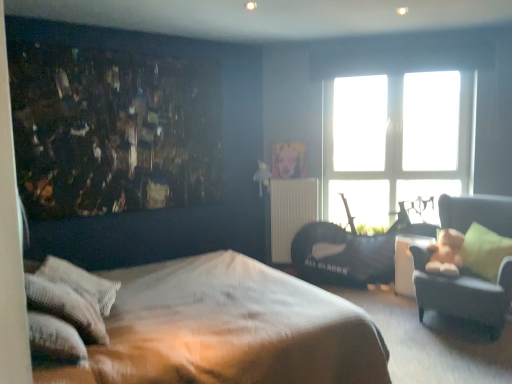
Question: Is brown textured bed at center touching black leather swivel chair at right?

Choices:
 (A) no
 (B) yes

Answer: (A)

Question: Is brown textured bed at center positioned before black leather swivel chair at right?

Choices:
 (A) no
 (B) yes

Answer: (B)

Question: From the image's perspective, is brown textured bed at center below black leather swivel chair at right?

Choices:
 (A) yes
 (B) no

Answer: (A)

Question: Is brown textured bed at center facing towards black leather swivel chair at right?

Choices:
 (A) no
 (B) yes

Answer: (B)

Question: From the image's perspective, would you say brown textured bed at center is positioned over black leather swivel chair at right?

Choices:
 (A) no
 (B) yes

Answer: (A)

Question: Is black leather swivel chair at right inside or outside of green fabric pillow at right, marked as the third pillow in a left-to-right arrangement?

Choices:
 (A) outside
 (B) inside

Answer: (A)

Question: Considering the positions of black leather swivel chair at right and green fabric pillow at right, arranged as the first pillow when viewed from the right, in the image, is black leather swivel chair at right bigger or smaller than green fabric pillow at right, arranged as the first pillow when viewed from the right,?

Choices:
 (A) small
 (B) big

Answer: (B)

Question: From a real-world perspective, is black leather swivel chair at right positioned above or below green fabric pillow at right, marked as the third pillow in a left-to-right arrangement?

Choices:
 (A) below
 (B) above

Answer: (A)

Question: Visually, is black leather swivel chair at right positioned to the left or to the right of green fabric pillow at right, marked as the third pillow in a left-to-right arrangement?

Choices:
 (A) left
 (B) right

Answer: (A)

Question: Considering the positions of metallic gold radiator at center and brown textured bed at center in the image, is metallic gold radiator at center wider or thinner than brown textured bed at center?

Choices:
 (A) thin
 (B) wide

Answer: (A)

Question: Is metallic gold radiator at center in front of or behind brown textured bed at center in the image?

Choices:
 (A) behind
 (B) front

Answer: (A)

Question: Based on their positions, is metallic gold radiator at center located to the left or right of brown textured bed at center?

Choices:
 (A) right
 (B) left

Answer: (A)

Question: Does point (311, 190) appear closer or farther from the camera than point (210, 296)?

Choices:
 (A) closer
 (B) farther

Answer: (B)

Question: Does point (86, 281) appear closer or farther from the camera than point (452, 185)?

Choices:
 (A) farther
 (B) closer

Answer: (B)

Question: Which is correct: white textured pillow at lower left, the second pillow in the back-to-front sequence, is inside transparent glass window at upper center, or outside of it?

Choices:
 (A) inside
 (B) outside

Answer: (B)